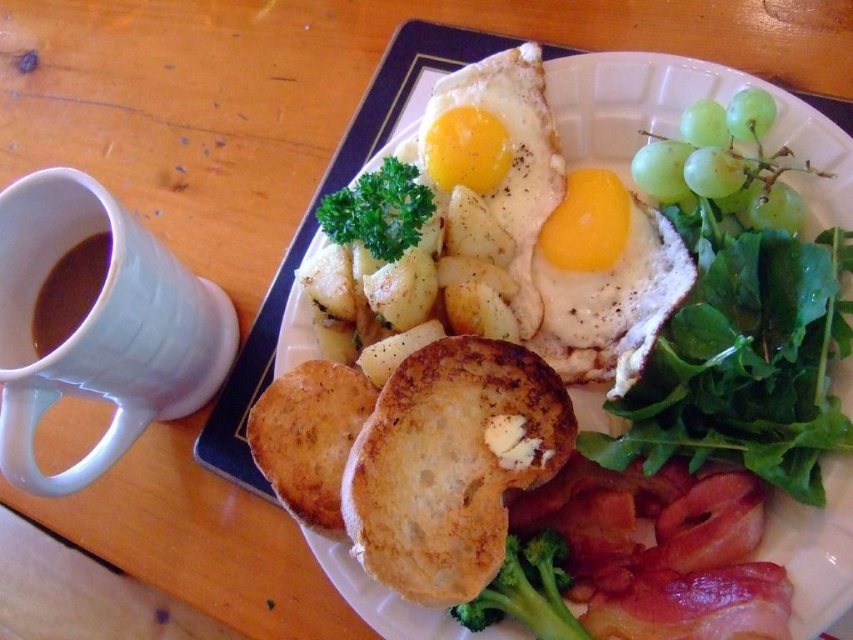
Can you confirm if green shiny grapes at upper right is wider than green matte broccoli at center?

Correct, the width of green shiny grapes at upper right exceeds that of green matte broccoli at center.

Does green shiny grapes at upper right appear under green matte broccoli at center?

No, green shiny grapes at upper right is not below green matte broccoli at center.

What do you see at coordinates (723, 163) in the screenshot? I see `green shiny grapes at upper right` at bounding box center [723, 163].

This screenshot has width=853, height=640. In order to click on green shiny grapes at upper right in this screenshot , I will do `click(723, 163)`.

Does white ceramic mug at left have a greater height compared to green shiny grapes at upper right?

Yes.

Is white ceramic mug at left behind green shiny grapes at upper right?

No, it is in front of green shiny grapes at upper right.

Find the location of a particular element. This screenshot has height=640, width=853. white ceramic mug at left is located at coordinates (99, 326).

Can you confirm if white plate at center is bigger than brown matte mug at upper left?

Indeed, white plate at center has a larger size compared to brown matte mug at upper left.

Which is below, white plate at center or brown matte mug at upper left?

brown matte mug at upper left is lower down.

Measure the distance between white plate at center and camera.

white plate at center is 35.86 inches away from camera.

You are a GUI agent. You are given a task and a screenshot of the screen. Output one action in this format:
    pyautogui.click(x=<x>, y=<y>)
    Task: Click on the white plate at center
    This screenshot has width=853, height=640.
    Given the screenshot: What is the action you would take?
    pyautogui.click(x=677, y=118)